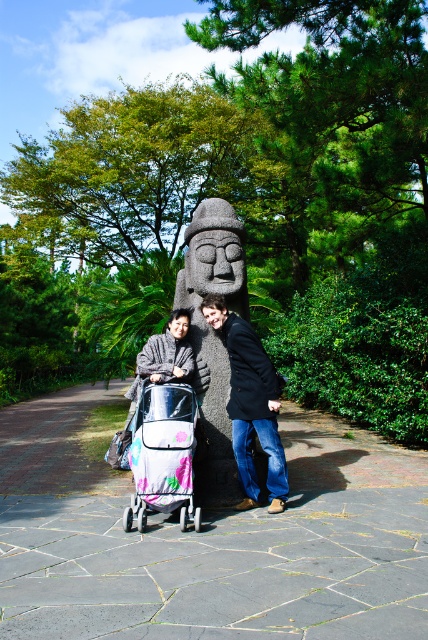
Question: Where is white fabric baby carriage at center located in relation to gray woolen sweater at center in the image?

Choices:
 (A) left
 (B) right

Answer: (B)

Question: Is the position of black matte jacket at center less distant than that of gray woolen sweater at center?

Choices:
 (A) yes
 (B) no

Answer: (A)

Question: Can you confirm if black matte jacket at center is positioned to the right of white fabric baby carriage at center?

Choices:
 (A) yes
 (B) no

Answer: (A)

Question: Which point is closer to the camera taking this photo?

Choices:
 (A) (142, 365)
 (B) (195, 484)

Answer: (B)

Question: Estimate the real-world distances between objects in this image. Which object is closer to the dark gray stone statue at center?

Choices:
 (A) gray woolen sweater at center
 (B) white fabric baby carriage at center
 (C) black matte jacket at center

Answer: (C)

Question: Among these points, which one is nearest to the camera?

Choices:
 (A) 213,326
 (B) 205,432
 (C) 172,337

Answer: (B)